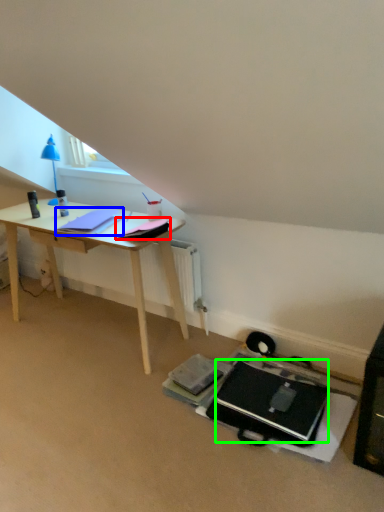
Question: Which object is positioned farthest from notepad (highlighted by a red box)? Select from notepad (highlighted by a blue box) and laptop (highlighted by a green box).

Choices:
 (A) notepad
 (B) laptop

Answer: (B)